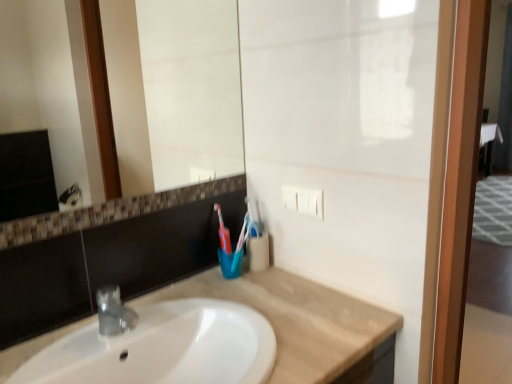
Question: Are beige marble countertop at center and blue plastic toothbrush at center far apart?

Choices:
 (A) yes
 (B) no

Answer: (B)

Question: Does beige marble countertop at center turn towards blue plastic toothbrush at center?

Choices:
 (A) no
 (B) yes

Answer: (A)

Question: Is beige marble countertop at center positioned with its back to blue plastic toothbrush at center?

Choices:
 (A) no
 (B) yes

Answer: (A)

Question: Would you say beige marble countertop at center is outside blue plastic toothbrush at center?

Choices:
 (A) yes
 (B) no

Answer: (A)

Question: Can you confirm if beige marble countertop at center is bigger than blue plastic toothbrush at center?

Choices:
 (A) yes
 (B) no

Answer: (A)

Question: Is wooden screen door at right inside the boundaries of white glossy mirror at upper center, or outside?

Choices:
 (A) inside
 (B) outside

Answer: (B)

Question: From a real-world perspective, is wooden screen door at right physically located above or below white glossy mirror at upper center?

Choices:
 (A) above
 (B) below

Answer: (B)

Question: Is wooden screen door at right bigger or smaller than white glossy mirror at upper center?

Choices:
 (A) small
 (B) big

Answer: (B)

Question: From the image's perspective, is wooden screen door at right located above or below white glossy mirror at upper center?

Choices:
 (A) above
 (B) below

Answer: (B)

Question: Is beige marble countertop at center to the left or to the right of blue plastic toothbrush at center in the image?

Choices:
 (A) left
 (B) right

Answer: (A)

Question: Considering the positions of beige marble countertop at center and blue plastic toothbrush at center in the image, is beige marble countertop at center bigger or smaller than blue plastic toothbrush at center?

Choices:
 (A) big
 (B) small

Answer: (A)

Question: From a real-world perspective, is beige marble countertop at center positioned above or below blue plastic toothbrush at center?

Choices:
 (A) below
 (B) above

Answer: (A)

Question: In terms of height, does beige marble countertop at center look taller or shorter compared to blue plastic toothbrush at center?

Choices:
 (A) short
 (B) tall

Answer: (A)

Question: From the image's perspective, is white glossy mirror at upper center above or below beige marble countertop at center?

Choices:
 (A) above
 (B) below

Answer: (A)

Question: Is white glossy mirror at upper center wider or thinner than beige marble countertop at center?

Choices:
 (A) thin
 (B) wide

Answer: (A)